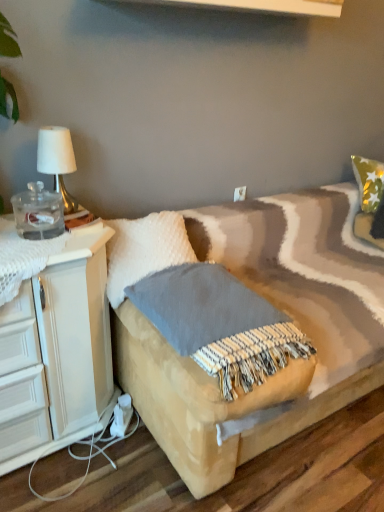
Question: Based on their sizes in the image, would you say gold metallic table lamp at upper left is bigger or smaller than white fluffy pillow at center?

Choices:
 (A) big
 (B) small

Answer: (B)

Question: In terms of width, does gold metallic table lamp at upper left look wider or thinner when compared to white fluffy pillow at center?

Choices:
 (A) thin
 (B) wide

Answer: (A)

Question: Estimate the real-world distances between objects in this image. Which object is closer to the gold metallic table lamp at upper left?

Choices:
 (A) white plastic electric outlet at upper center
 (B) textured beige blanket at center
 (C) white fluffy pillow at center

Answer: (C)

Question: Estimate the real-world distances between objects in this image. Which object is closer to the textured beige blanket at center?

Choices:
 (A) gold metallic table lamp at upper left
 (B) white plastic electric outlet at upper center
 (C) white fluffy pillow at center

Answer: (C)